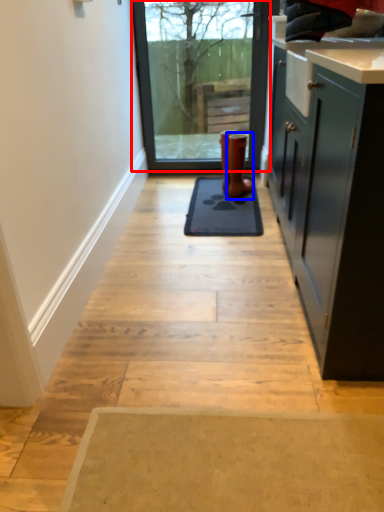
Question: Which point is further to the camera, window (highlighted by a red box) or footwear (highlighted by a blue box)?

Choices:
 (A) window
 (B) footwear

Answer: (A)